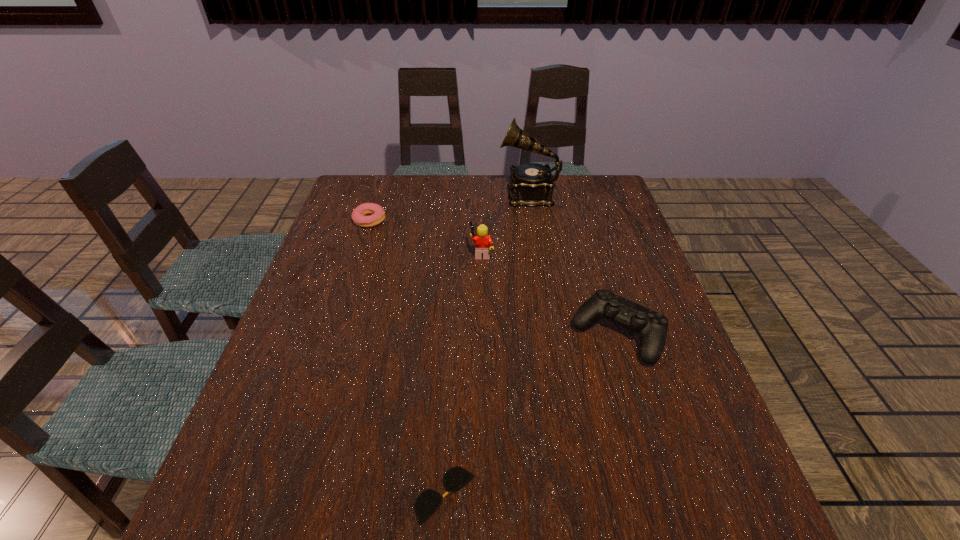
You are a GUI agent. You are given a task and a screenshot of the screen. Output one action in this format:
    pyautogui.click(x=<x>, y=<y>)
    Task: Click on the farthest object
    
    Given the screenshot: What is the action you would take?
    (x=531, y=184)

Where is `phonograph record`? The height and width of the screenshot is (540, 960). phonograph record is located at coordinates (531, 184).

You are a GUI agent. You are given a task and a screenshot of the screen. Output one action in this format:
    pyautogui.click(x=<x>, y=<y>)
    Task: Click on the Lego
    This screenshot has width=960, height=540.
    Given the screenshot: What is the action you would take?
    pyautogui.click(x=483, y=242)

Find the location of a particular element. the fourth shortest object is located at coordinates point(483,242).

At what (x,y) coordinates should I click in order to perform the action: click on the second nearest object. Please return your answer as a coordinate pair (x, y). This screenshot has width=960, height=540. Looking at the image, I should click on (652, 326).

This screenshot has height=540, width=960. Identify the location of control. (652, 326).

Locate an element on the screen. The image size is (960, 540). the fourth tallest object is located at coordinates (376, 213).

The height and width of the screenshot is (540, 960). In order to click on doughnut in this screenshot , I will do `click(376, 213)`.

The height and width of the screenshot is (540, 960). In order to click on spectacles in this screenshot , I will do `click(429, 500)`.

This screenshot has height=540, width=960. Find the location of `the shortest object`. the shortest object is located at coordinates (429, 500).